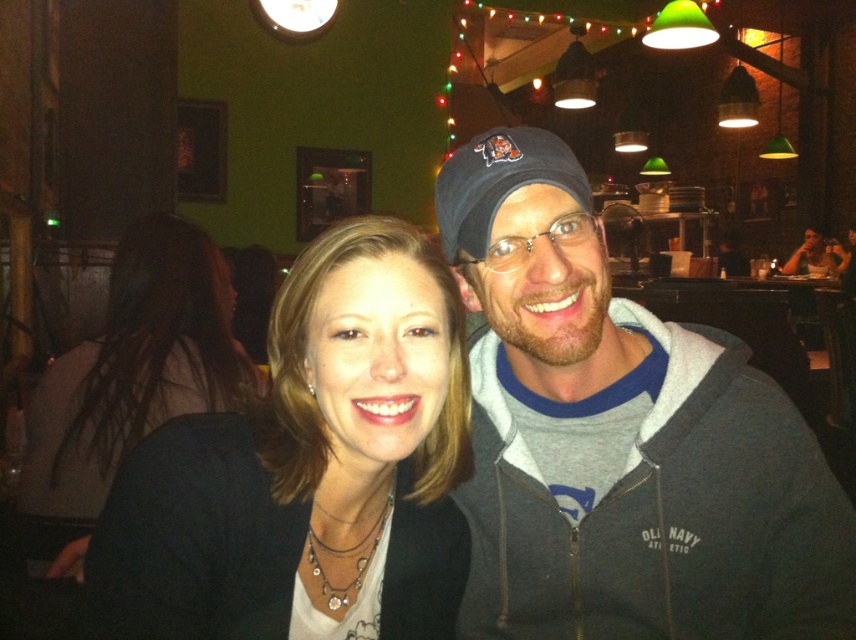
Consider the image. You are standing at the point marked as point (783, 544) in the image. You want to move to the entrance of the bar, which is located behind you. Can you turn around and walk directly to the entrance without moving your feet?

The point marked as point (783, 544) is 36.04 inches away from the viewer. Since you are already at that point, you can turn around and walk directly to the entrance located behind you without needing to move your feet first.

You are a photographer trying to capture a candid shot of the two people wearing the gray fleece jacket at center and the matte black jacket at center. Which jacket is closer to the right side of the frame?

The gray fleece jacket at center is positioned on the right side of the matte black jacket at center, so it is closer to the right side of the frame.

You are a photographer trying to capture a clear shot of the matte black jacket at center and the matte black shirt at center. Which object is closer to the camera?

The matte black jacket at center is closer to the camera because it is in front of the matte black shirt at center.